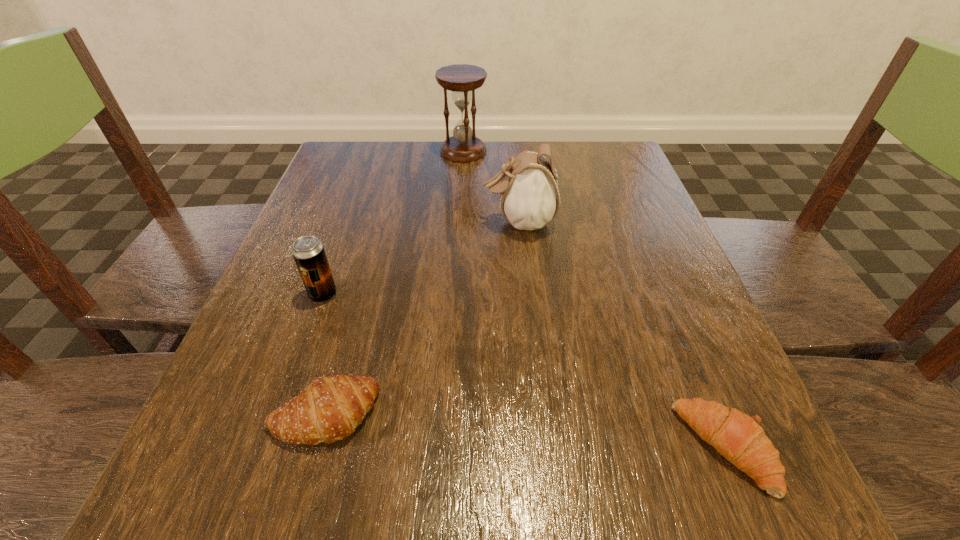
What are the coordinates of `vacant space that satisfies the following two spatial constraints: 1. on the front-facing side of the pouch; 2. on the front side of the beer can` in the screenshot? It's located at (526, 294).

Where is `vacant region that satisfies the following two spatial constraints: 1. on the front-facing side of the fourth nearest object; 2. on the back side of the shortest object`? This screenshot has height=540, width=960. vacant region that satisfies the following two spatial constraints: 1. on the front-facing side of the fourth nearest object; 2. on the back side of the shortest object is located at coordinates (542, 448).

At what (x,y) coordinates should I click in order to perform the action: click on vacant point that satisfies the following two spatial constraints: 1. on the back side of the third tallest object; 2. on the right side of the farthest object. Please return your answer as a coordinate pair (x, y). The image size is (960, 540). Looking at the image, I should click on (373, 152).